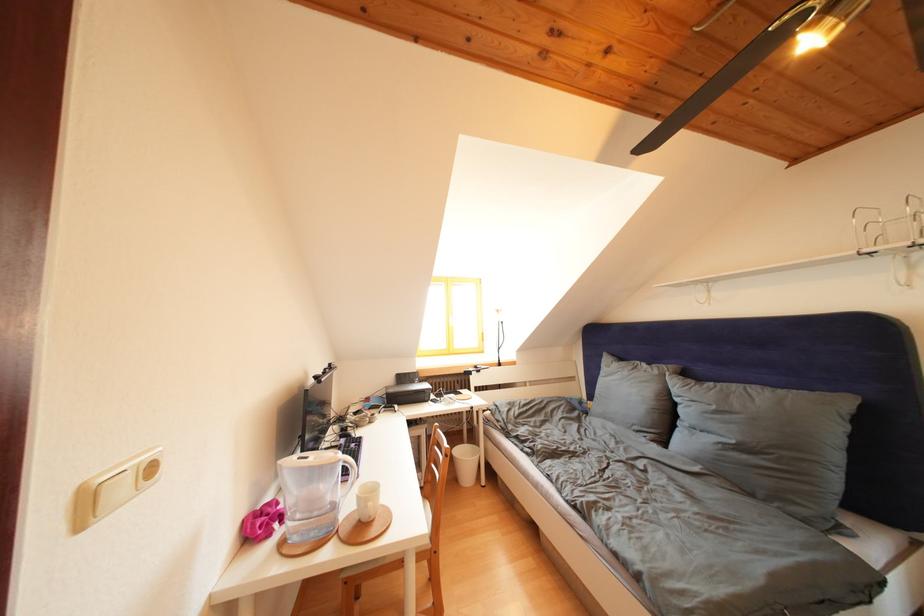
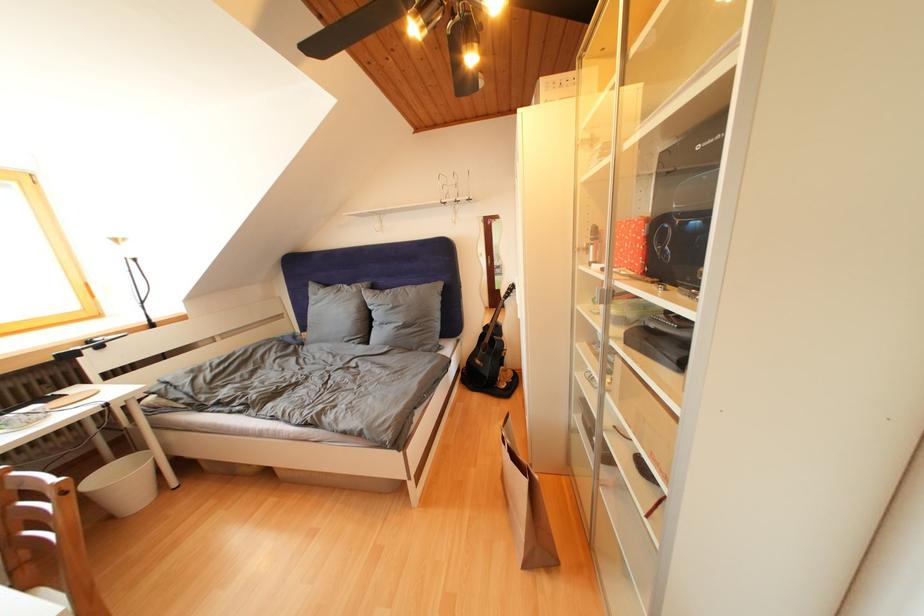
How did the camera likely rotate?

The camera's rotation is toward right-down.